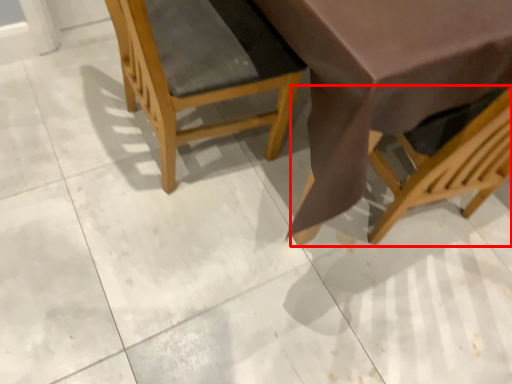
Question: In this image, where is chair (annotated by the red box) located relative to chair?

Choices:
 (A) right
 (B) left

Answer: (A)